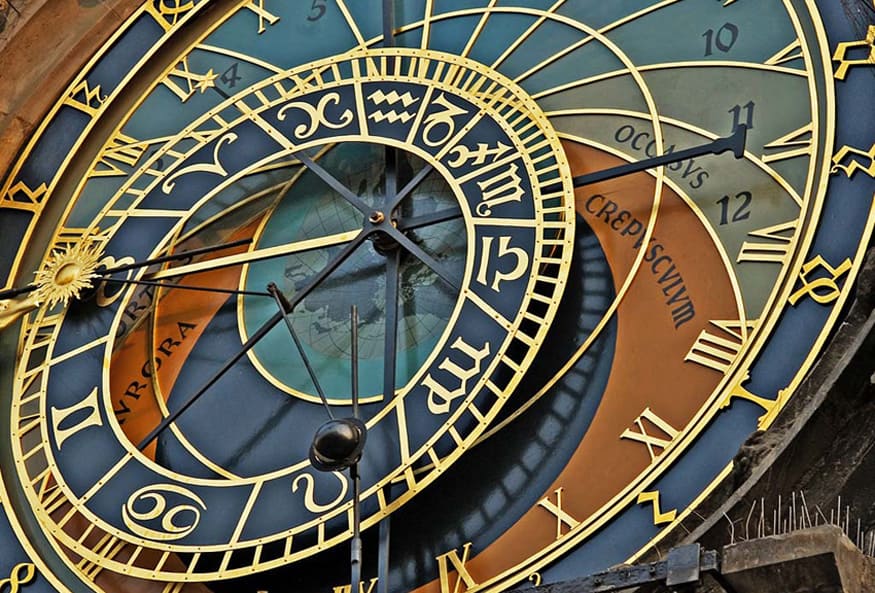
Image resolution: width=875 pixels, height=593 pixels. Identify the location of clock. (634, 371).